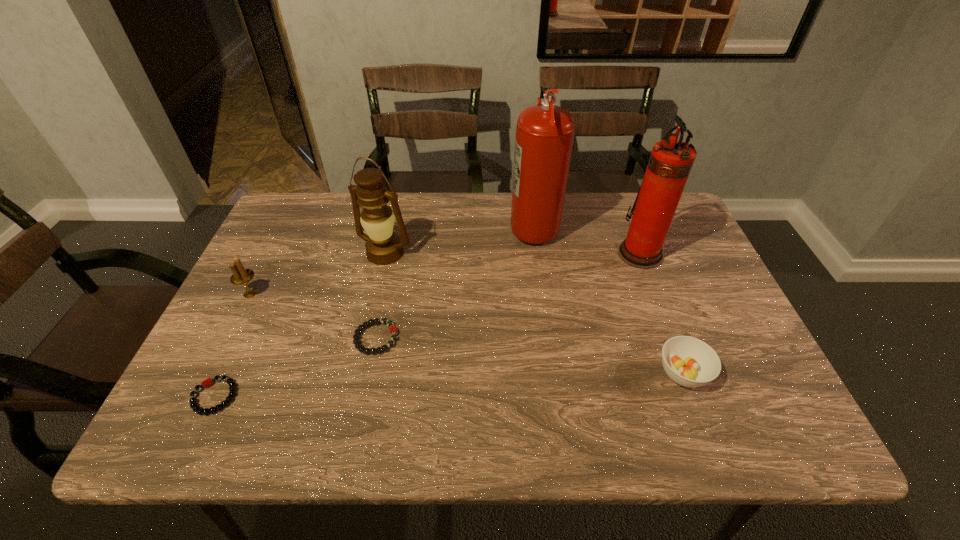
This screenshot has height=540, width=960. I want to click on the third object from right to left, so click(544, 139).

Find the location of a particular element. The height and width of the screenshot is (540, 960). the right fire extinguisher is located at coordinates (670, 162).

Identify the location of the sixth shortest object. The height and width of the screenshot is (540, 960). (670, 162).

The width and height of the screenshot is (960, 540). In order to click on oil lamp in this screenshot , I will do `click(383, 247)`.

The image size is (960, 540). I want to click on candle holder, so click(x=241, y=276).

The width and height of the screenshot is (960, 540). Find the location of `the fourth tallest object`. the fourth tallest object is located at coordinates [x=241, y=276].

The width and height of the screenshot is (960, 540). I want to click on the third shortest object, so click(x=688, y=361).

I want to click on the right bracelet, so click(393, 331).

Where is `the nearer bracelet`? The image size is (960, 540). the nearer bracelet is located at coordinates 194,405.

Find the location of a particular element. This screenshot has width=960, height=540. free point located on the instruction side of the left fire extinguisher is located at coordinates (445, 225).